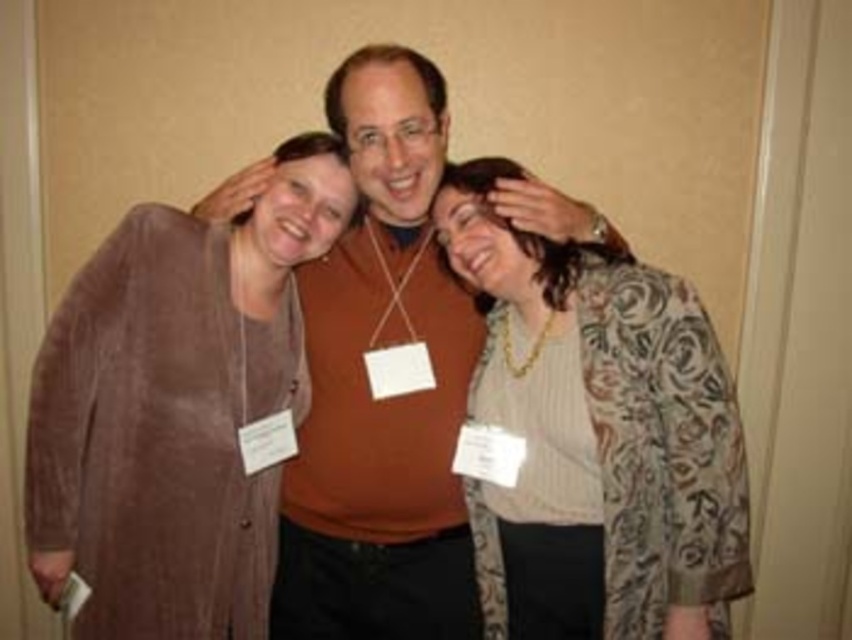
Measure the distance between matte brown cardigan at left and camera.

matte brown cardigan at left and camera are 6.22 feet apart.

Is matte brown cardigan at left positioned in front of patterned silk blouse at center?

No.

Describe the element at coordinates (176, 408) in the screenshot. The image size is (852, 640). I see `matte brown cardigan at left` at that location.

Locate an element on the screen. The height and width of the screenshot is (640, 852). matte brown cardigan at left is located at coordinates (176, 408).

From the picture: Between matte brown cardigan at left and matte brown sweater at center, which one is positioned higher?

matte brown sweater at center is higher up.

Who is more forward, (206, 388) or (459, 502)?

Positioned in front is point (206, 388).

Is point (59, 442) closer to camera compared to point (330, 500)?

Yes, point (59, 442) is in front of point (330, 500).

At what (x,y) coordinates should I click in order to perform the action: click on matte brown cardigan at left. Please return your answer as a coordinate pair (x, y). The width and height of the screenshot is (852, 640). Looking at the image, I should click on (176, 408).

Who is taller, patterned silk blouse at center or matte brown sweater at center?

With more height is matte brown sweater at center.

Can you confirm if patterned silk blouse at center is positioned to the right of matte brown sweater at center?

Yes, patterned silk blouse at center is to the right of matte brown sweater at center.

Where is `patterned silk blouse at center`? This screenshot has height=640, width=852. patterned silk blouse at center is located at coordinates 597,435.

Image resolution: width=852 pixels, height=640 pixels. What are the coordinates of `patterned silk blouse at center` in the screenshot? It's located at (597, 435).